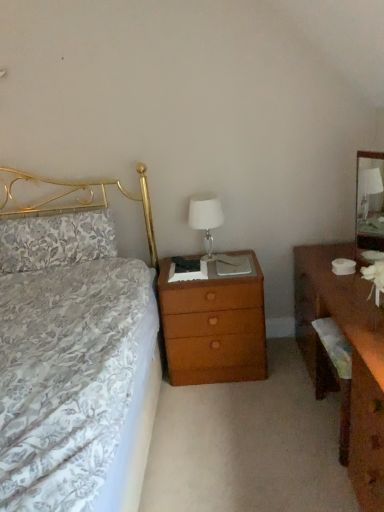
Question: Could you tell me if wooden desk at right is turned towards floral fabric pillow at left?

Choices:
 (A) yes
 (B) no

Answer: (A)

Question: Does wooden desk at right have a greater width compared to floral fabric pillow at left?

Choices:
 (A) no
 (B) yes

Answer: (B)

Question: Is the depth of wooden desk at right greater than that of floral fabric pillow at left?

Choices:
 (A) no
 (B) yes

Answer: (A)

Question: Is wooden desk at right bigger than floral fabric pillow at left?

Choices:
 (A) yes
 (B) no

Answer: (A)

Question: Does wooden desk at right have a greater height compared to floral fabric pillow at left?

Choices:
 (A) yes
 (B) no

Answer: (A)

Question: Is brown wood nightstand at center to the left or to the right of wooden desk at right in the image?

Choices:
 (A) left
 (B) right

Answer: (A)

Question: From the image's perspective, is brown wood nightstand at center positioned above or below wooden desk at right?

Choices:
 (A) below
 (B) above

Answer: (A)

Question: From a real-world perspective, is brown wood nightstand at center positioned above or below wooden desk at right?

Choices:
 (A) above
 (B) below

Answer: (B)

Question: Considering the positions of brown wood nightstand at center and wooden desk at right in the image, is brown wood nightstand at center taller or shorter than wooden desk at right?

Choices:
 (A) tall
 (B) short

Answer: (A)

Question: Is floral fabric pillow at left to the left or to the right of wooden desk at right in the image?

Choices:
 (A) left
 (B) right

Answer: (A)

Question: Is point coord(67,217) closer or farther from the camera than point coord(311,245)?

Choices:
 (A) closer
 (B) farther

Answer: (A)

Question: From a real-world perspective, is floral fabric pillow at left physically located above or below wooden desk at right?

Choices:
 (A) below
 (B) above

Answer: (B)

Question: Considering their positions, is floral fabric pillow at left located in front of or behind wooden desk at right?

Choices:
 (A) front
 (B) behind

Answer: (B)

Question: Looking at the image, does clear glass mirror at right seem bigger or smaller compared to floral fabric pillow at left?

Choices:
 (A) big
 (B) small

Answer: (B)

Question: From the image's perspective, is clear glass mirror at right above or below floral fabric pillow at left?

Choices:
 (A) above
 (B) below

Answer: (A)